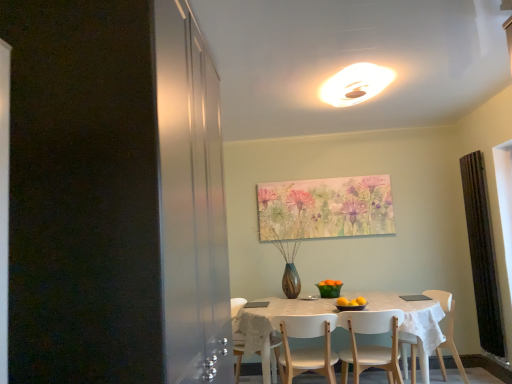
Where is `free space above white glossy light fixture at upper center (from a real-world perspective)`? This screenshot has width=512, height=384. free space above white glossy light fixture at upper center (from a real-world perspective) is located at coordinates (356, 86).